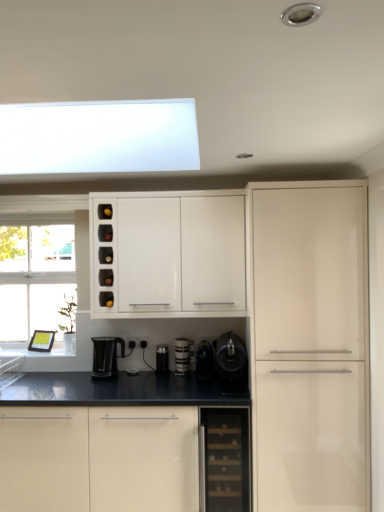
Question: From the image's perspective, is black glass dishwasher at lower center on black plastic kettle at lower center?

Choices:
 (A) no
 (B) yes

Answer: (A)

Question: Is black glass dishwasher at lower center positioned behind black plastic kettle at lower center?

Choices:
 (A) yes
 (B) no

Answer: (B)

Question: Is black glass dishwasher at lower center thinner than black plastic kettle at lower center?

Choices:
 (A) yes
 (B) no

Answer: (B)

Question: Is black glass dishwasher at lower center not inside black plastic kettle at lower center?

Choices:
 (A) no
 (B) yes

Answer: (B)

Question: Does black glass dishwasher at lower center appear on the right side of black plastic kettle at lower center?

Choices:
 (A) yes
 (B) no

Answer: (A)

Question: From a real-world perspective, is white glossy cabinet at lower center, marked as the 1th cabinetry in a bottom-to-top arrangement, physically located above or below matte black coffee maker at center, which is counted as the first appliance, starting from the left?

Choices:
 (A) above
 (B) below

Answer: (B)

Question: Is white glossy cabinet at lower center, marked as the 1th cabinetry in a bottom-to-top arrangement, wider or thinner than matte black coffee maker at center, which is counted as the first appliance, starting from the left?

Choices:
 (A) thin
 (B) wide

Answer: (B)

Question: Does point (23, 450) appear closer or farther from the camera than point (157, 359)?

Choices:
 (A) farther
 (B) closer

Answer: (B)

Question: From the image's perspective, is white glossy cabinet at lower center, which ranks as the second cabinetry in top-to-bottom order, positioned above or below matte black coffee maker at center, acting as the fourth appliance starting from the right?

Choices:
 (A) below
 (B) above

Answer: (A)

Question: Is point (155, 364) closer or farther from the camera than point (236, 372)?

Choices:
 (A) farther
 (B) closer

Answer: (A)

Question: Is matte black coffee maker at center, which is counted as the first appliance, starting from the left, to the left or to the right of black plastic coffee machine at center, which is the 4th appliance in left-to-right order, in the image?

Choices:
 (A) left
 (B) right

Answer: (A)

Question: Considering the positions of matte black coffee maker at center, acting as the fourth appliance starting from the right, and black plastic coffee machine at center, which is the 4th appliance in left-to-right order, in the image, is matte black coffee maker at center, acting as the fourth appliance starting from the right, taller or shorter than black plastic coffee machine at center, which is the 4th appliance in left-to-right order,?

Choices:
 (A) tall
 (B) short

Answer: (B)

Question: Choose the correct answer: Is matte black coffee maker at center, which is counted as the first appliance, starting from the left, inside black plastic coffee machine at center, the 1th appliance in the right-to-left sequence, or outside it?

Choices:
 (A) outside
 (B) inside

Answer: (A)

Question: From a real-world perspective, relative to white glossy coffee cup at center, acting as the second appliance starting from the left, is black plastic coffee machine at center, the 1th appliance in the right-to-left sequence, vertically above or below?

Choices:
 (A) above
 (B) below

Answer: (A)

Question: From the image's perspective, is black plastic coffee machine at center, which is the 4th appliance in left-to-right order, located above or below white glossy coffee cup at center, acting as the second appliance starting from the left?

Choices:
 (A) below
 (B) above

Answer: (B)